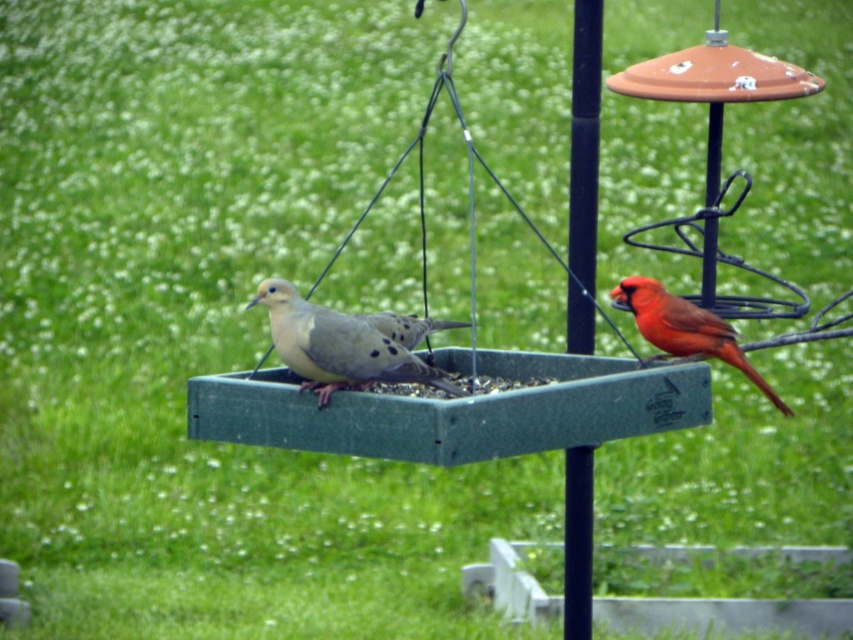
Where is `black metal pole at center`? This screenshot has height=640, width=853. black metal pole at center is located at coordinates (584, 140).

Consider the image. Can you confirm if black metal pole at center is taller than speckled beige dove at center?

Indeed, black metal pole at center has a greater height compared to speckled beige dove at center.

Who is more distant from viewer, (x=572, y=173) or (x=316, y=364)?

The point (x=572, y=173) is behind.

Find the location of a particular element. Image resolution: width=853 pixels, height=640 pixels. black metal pole at center is located at coordinates (584, 140).

Who is higher up, speckled beige dove at center or shiny red cardinal at right?

speckled beige dove at center is above.

From the picture: Is speckled beige dove at center to the left of shiny red cardinal at right from the viewer's perspective?

Correct, you'll find speckled beige dove at center to the left of shiny red cardinal at right.

I want to click on speckled beige dove at center, so click(346, 342).

You are a GUI agent. You are given a task and a screenshot of the screen. Output one action in this format:
    pyautogui.click(x=<x>, y=<y>)
    Task: Click on the speckled beige dove at center
    
    Given the screenshot: What is the action you would take?
    pyautogui.click(x=346, y=342)

Does black metal pole at center have a greater height compared to shiny red cardinal at right?

Yes, black metal pole at center is taller than shiny red cardinal at right.

From the picture: Does black metal pole at center have a lesser height compared to shiny red cardinal at right?

In fact, black metal pole at center may be taller than shiny red cardinal at right.

Find the location of a particular element. The height and width of the screenshot is (640, 853). black metal pole at center is located at coordinates (584, 140).

Find the location of a particular element. black metal pole at center is located at coordinates (584, 140).